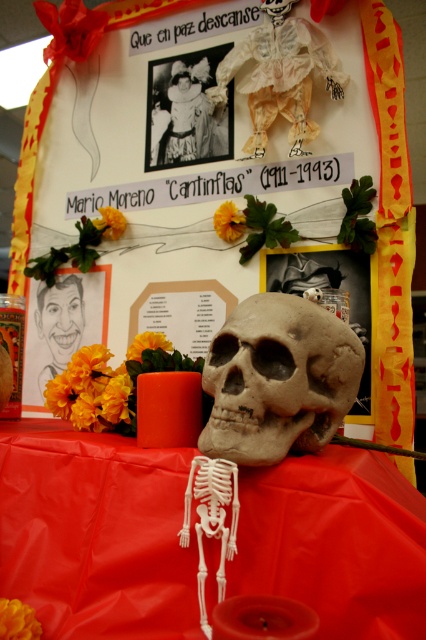
Is red fabric tablecloth at center wider than white paper doll at upper center?

Yes, red fabric tablecloth at center is wider than white paper doll at upper center.

Which is more to the left, red fabric tablecloth at center or white paper doll at upper center?

red fabric tablecloth at center is more to the left.

Between point (210, 561) and point (276, 100), which one is positioned behind?

The point (276, 100) is more distant.

What are the coordinates of `red fabric tablecloth at center` in the screenshot? It's located at (95, 532).

Is red fabric tablecloth at center smaller than gray matte skull at center?

Incorrect, red fabric tablecloth at center is not smaller in size than gray matte skull at center.

What do you see at coordinates (95, 532) in the screenshot?
I see `red fabric tablecloth at center` at bounding box center [95, 532].

Locate an element on the screen. Image resolution: width=426 pixels, height=640 pixels. red fabric tablecloth at center is located at coordinates (95, 532).

Where is `red fabric tablecloth at center`? red fabric tablecloth at center is located at coordinates (95, 532).

You are a GUI agent. You are given a task and a screenshot of the screen. Output one action in this format:
    pyautogui.click(x=<x>, y=<y>)
    Task: Click on the white paper doll at upper center
    
    Given the screenshot: What is the action you would take?
    pyautogui.click(x=279, y=76)

Between point (296, 28) and point (51, 298), which one is positioned in front?

Point (296, 28) is more forward.

Who is more forward, (279, 92) or (69, 288)?

Point (279, 92) is more forward.

Find the location of a particular element. This screenshot has width=426, height=640. white paper doll at upper center is located at coordinates (279, 76).